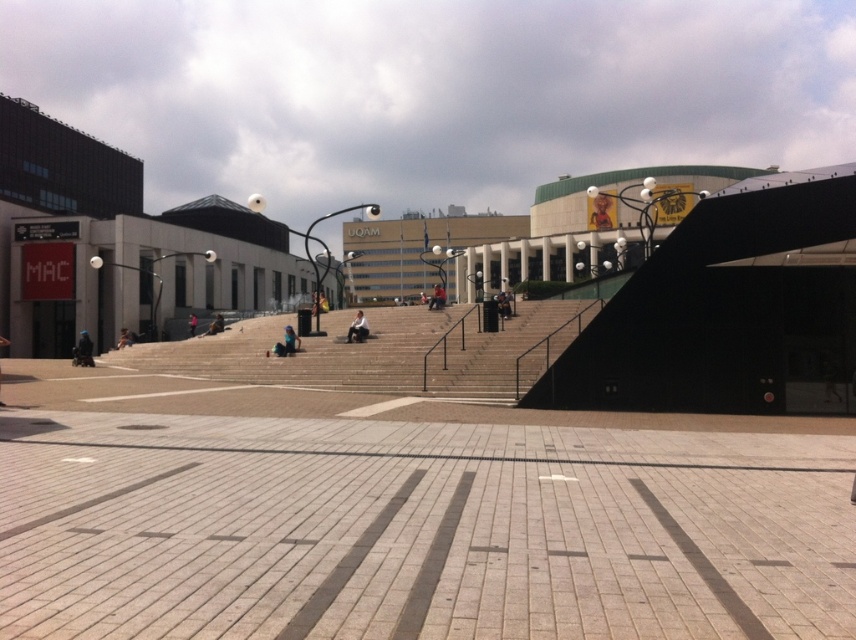
You are standing on the paved area in the urban plaza and see the concrete stairs at center and the dark blue jeans at lower left. Which object is closer to you?

The concrete stairs at center is closer to you because it is in front of the dark blue jeans at lower left.